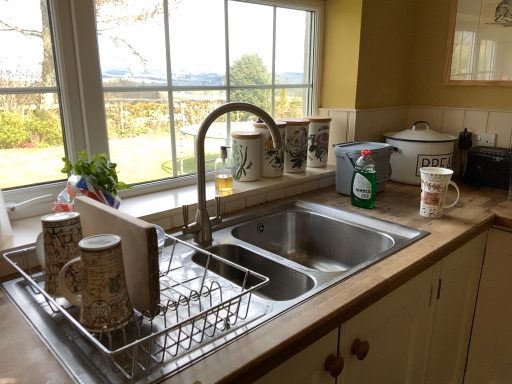
Question: From a real-world perspective, is wooden at left positioned under porcelain floral canisters at upper right, the fourth appliance when ordered from front to back, based on gravity?

Choices:
 (A) no
 (B) yes

Answer: (B)

Question: Is wooden at left bigger than porcelain floral canisters at upper right, which is the third appliance in right-to-left order?

Choices:
 (A) no
 (B) yes

Answer: (B)

Question: Is the depth of wooden at left less than that of porcelain floral canisters at upper right, which ranks as the 2th appliance in left-to-right order?

Choices:
 (A) yes
 (B) no

Answer: (A)

Question: Is wooden at left at the right side of porcelain floral canisters at upper right, which ranks as the 2th appliance in left-to-right order?

Choices:
 (A) yes
 (B) no

Answer: (B)

Question: Considering the relative sizes of wooden at left and porcelain floral canisters at upper right, which is the third appliance in right-to-left order, in the image provided, is wooden at left thinner than porcelain floral canisters at upper right, which is the third appliance in right-to-left order,?

Choices:
 (A) no
 (B) yes

Answer: (A)

Question: Could you tell me if wooden at left is turned towards porcelain floral canisters at upper right, which ranks as the 2th appliance in left-to-right order?

Choices:
 (A) no
 (B) yes

Answer: (A)

Question: Is black plastic toaster at right, which is the 1th appliance from right to left, next to green plastic container at upper right, positioned as the 2th appliance in front-to-back order?

Choices:
 (A) yes
 (B) no

Answer: (B)

Question: Can you confirm if black plastic toaster at right, acting as the fourth appliance starting from the left, is taller than green plastic container at upper right, the third appliance when ordered from left to right?

Choices:
 (A) no
 (B) yes

Answer: (A)

Question: Can you confirm if black plastic toaster at right, which is the 1th appliance from right to left, is positioned to the right of green plastic container at upper right, the third appliance when ordered from left to right?

Choices:
 (A) yes
 (B) no

Answer: (A)

Question: Is black plastic toaster at right, the 2th appliance when ordered from back to front, looking in the opposite direction of green plastic container at upper right, positioned as the 2th appliance in right-to-left order?

Choices:
 (A) no
 (B) yes

Answer: (A)

Question: Is black plastic toaster at right, the 2th appliance when ordered from back to front, shorter than green plastic container at upper right, positioned as the 2th appliance in front-to-back order?

Choices:
 (A) no
 (B) yes

Answer: (B)

Question: From the image's perspective, is black plastic toaster at right, the 2th appliance when ordered from back to front, located above green plastic container at upper right, the third appliance when ordered from left to right?

Choices:
 (A) yes
 (B) no

Answer: (A)

Question: Does metallic dish rack at lower left, which ranks as the 4th appliance in back-to-front order, have a lesser width compared to transparent glass window at upper right, which is the 2th window in left-to-right order?

Choices:
 (A) yes
 (B) no

Answer: (B)